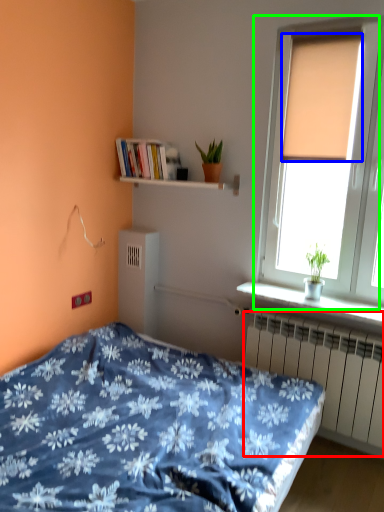
Question: Based on their relative distances, which object is farther from radiator (highlighted by a red box)? Choose from curtain (highlighted by a blue box) and window (highlighted by a green box).

Choices:
 (A) curtain
 (B) window

Answer: (A)